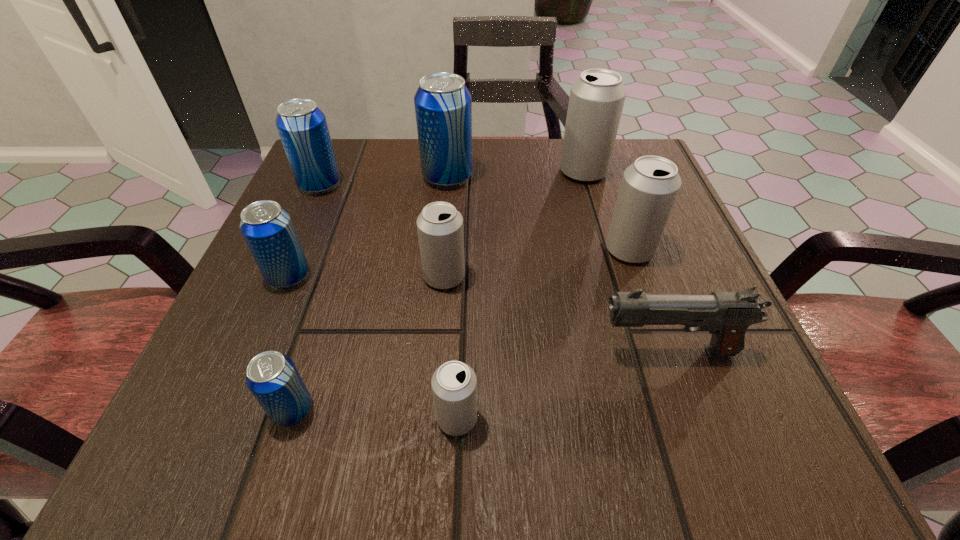
You are a GUI agent. You are given a task and a screenshot of the screen. Output one action in this format:
    pyautogui.click(x=<x>, y=<y>)
    Task: Click on the free space that satisfies the following two spatial constraints: 1. on the front side of the second biggest blue beer can; 2. on the right side of the second smallest blue beer can
    Image resolution: width=960 pixels, height=540 pixels.
    Given the screenshot: What is the action you would take?
    pyautogui.click(x=280, y=276)